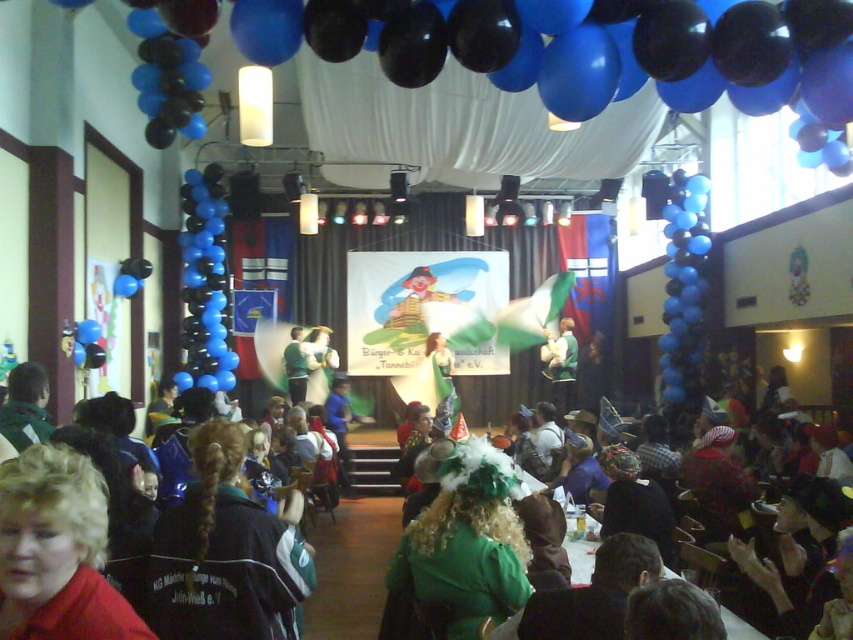
You are standing at the entrance of the event hall and want to take a photo of the point at coordinates point [476,625]. If your camera has a maximum focus range of 3 meters, will you be able to focus on that point?

The distance of point [476,625] from viewer is 3.05 meters, so the camera cannot focus on it since it exceeds the maximum range of 3 meters.

You are at a party and want to take a photo with the green velvet hat at center and the green fabric dress at lower center. Which object should you stand to the right of to have both in the frame?

You should stand to the right of the green velvet hat at center because it is positioned to the left of the green fabric dress at lower center, so placing yourself to its right will include both in the photo.

You are a photographer at the event and want to capture both the green velvet dress at center and the green matte shirt at center in a single shot. Which one is closer to you so that you can focus on it first?

The green velvet dress at center is closer to you than the green matte shirt at center, so you can focus on it first.